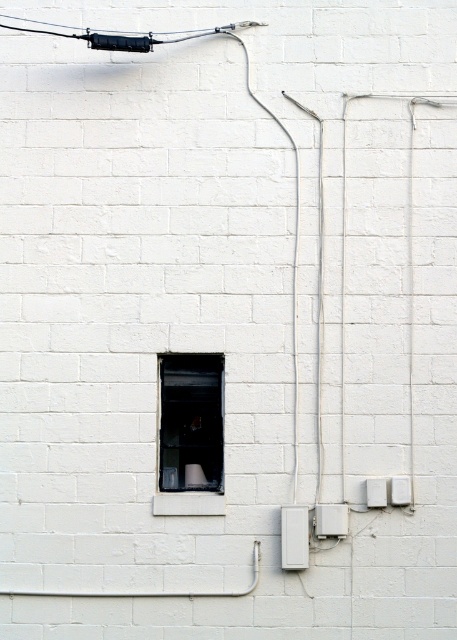
You are an electrician inspecting the wall. You need to determine if the transparent glass window at center can fit over the white plastic electric outlet at lower right. Based on their widths, can the window cover the outlet?

The transparent glass window at center is wider than the white plastic electric outlet at lower right, so the window can cover the outlet since its width surpasses the outlet.

You are a maintenance worker needing to access the white plastic electric outlet at lower right. The transparent glass window at center is in your way. Can you reach the outlet without moving the window?

The transparent glass window at center is positioned over the white plastic electric outlet at lower right, so you cannot reach the outlet without moving the window.